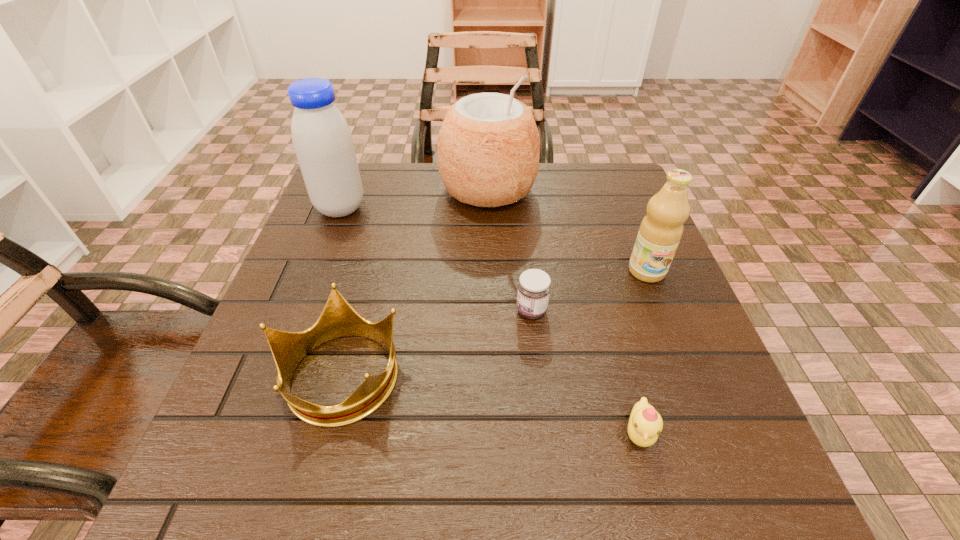
Where is `free space located on the front of the third shortest object`? This screenshot has width=960, height=540. free space located on the front of the third shortest object is located at coordinates (312, 480).

Find the location of `free region located 0.100m on the front label of the jam`. free region located 0.100m on the front label of the jam is located at coordinates (462, 311).

This screenshot has height=540, width=960. Identify the location of vacant region located 0.200m on the front label of the jam. point(408,311).

Locate an element on the screen. The height and width of the screenshot is (540, 960). vacant area situated on the front label of the jam is located at coordinates (310, 311).

Where is `free location located 0.070m on the front-facing side of the fifth object from left to right`? The width and height of the screenshot is (960, 540). free location located 0.070m on the front-facing side of the fifth object from left to right is located at coordinates (660, 512).

Where is `coconut present at the far edge`? The width and height of the screenshot is (960, 540). coconut present at the far edge is located at coordinates (488, 146).

Identify the location of soya milk that is at the far edge. (322, 140).

Locate an element on the screen. This screenshot has width=960, height=540. object at the near edge is located at coordinates coord(645,424).

Identify the location of soya milk that is at the left edge. (322, 140).

You are a GUI agent. You are given a task and a screenshot of the screen. Output one action in this format:
    pyautogui.click(x=<x>, y=<y>)
    Task: Click on the crown present at the left edge
    Image resolution: width=960 pixels, height=540 pixels.
    Given the screenshot: What is the action you would take?
    pyautogui.click(x=338, y=319)